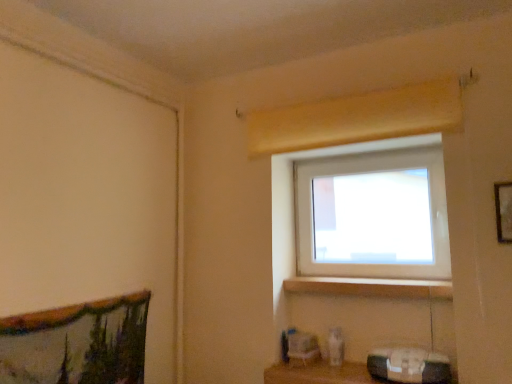
Find the location of a particular element. free space above wooden shelf at lower center (from a real-world perspective) is located at coordinates (335, 367).